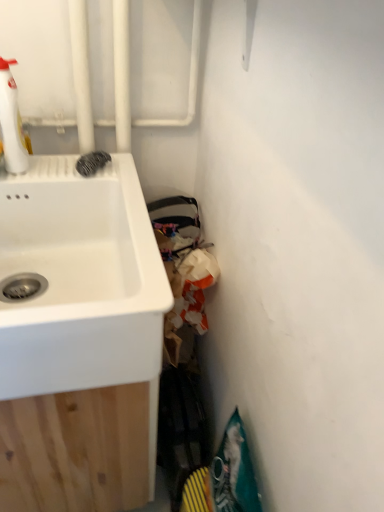
Locate an element on the screen. unoccupied region to the right of white glossy spray bottle at upper left is located at coordinates (79, 170).